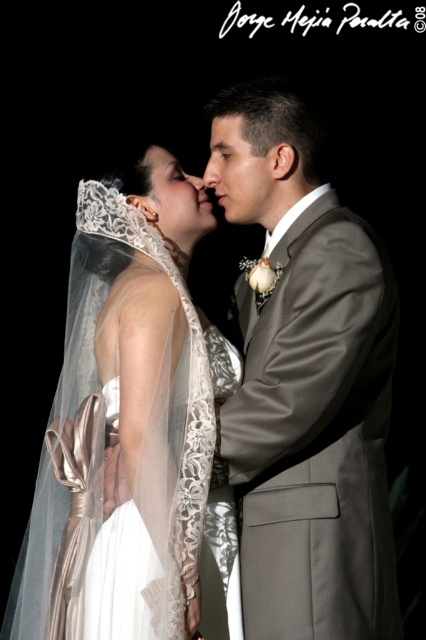
Is point (114, 204) positioned before point (229, 157)?

Yes, point (114, 204) is closer to viewer.

This screenshot has width=426, height=640. In order to click on white lace veil at upper left in this screenshot , I will do `click(126, 422)`.

Is point (167, 164) closer to viewer compared to point (184, 172)?

That is True.

Does matte white veil at center have a greater height compared to matte white nose at center?

Correct, matte white veil at center is much taller as matte white nose at center.

Is point (187, 205) more distant than point (204, 188)?

That is False.

You are a GUI agent. You are given a task and a screenshot of the screen. Output one action in this format:
    pyautogui.click(x=<x>, y=<y>)
    Task: Click on the matte white veil at center
    The height and width of the screenshot is (640, 426).
    Given the screenshot: What is the action you would take?
    pyautogui.click(x=176, y=195)

Does smooth skin face at center have a greater height compared to matte gray forehead at upper center?

Yes.

Consider the image. Which is below, smooth skin face at center or matte gray forehead at upper center?

Positioned lower is smooth skin face at center.

Who is more forward, (249, 147) or (219, 140)?

Positioned in front is point (249, 147).

Locate an element on the screen. The height and width of the screenshot is (640, 426). smooth skin face at center is located at coordinates (244, 173).